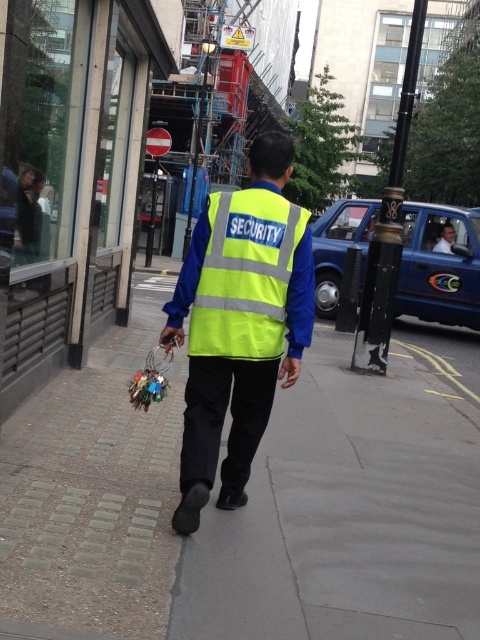
Question: Which object is farther from the camera taking this photo?

Choices:
 (A) high-visibility fabric security vest at center
 (B) yellow reflective vest at center
 (C) brick paved sidewalk at center

Answer: (B)

Question: Which of the following is the farthest from the observer?

Choices:
 (A) yellow reflective vest at center
 (B) high-visibility fabric security vest at center

Answer: (A)

Question: Is brick paved sidewalk at center to the left of yellow reflective vest at center from the viewer's perspective?

Choices:
 (A) no
 (B) yes

Answer: (B)

Question: Which of these objects is positioned closest to the yellow reflective vest at center?

Choices:
 (A) high-visibility fabric security vest at center
 (B) brick paved sidewalk at center

Answer: (A)

Question: Is high-visibility fabric security vest at center wider than yellow reflective vest at center?

Choices:
 (A) no
 (B) yes

Answer: (B)

Question: Is the position of brick paved sidewalk at center more distant than that of high-visibility fabric security vest at center?

Choices:
 (A) no
 (B) yes

Answer: (A)